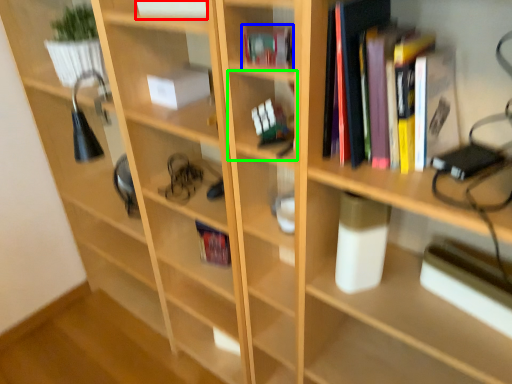
Question: Based on their relative distances, which object is nearer to book (highlighted by a red box)? Choose from book (highlighted by a blue box) and shelf (highlighted by a green box).

Choices:
 (A) book
 (B) shelf

Answer: (A)